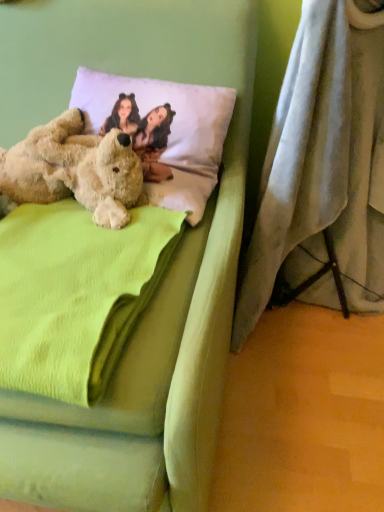
Describe the element at coordinates (171, 130) in the screenshot. I see `white soft pillow at upper center` at that location.

I want to click on gray fabric curtain at lower right, so click(323, 164).

Does point (61, 201) come in front of point (121, 81)?

Yes, it is in front of point (121, 81).

Is green fleece blanket at center situated inside white soft pillow at upper center or outside?

green fleece blanket at center is located beyond the bounds of white soft pillow at upper center.

Is green fleece blanket at center touching white soft pillow at upper center?

green fleece blanket at center and white soft pillow at upper center are not in contact.

Between fuzzy beige teddy bear at left and green fleece blanket at center, which one has larger width?

green fleece blanket at center.

Would you consider fuzzy beige teddy bear at left to be distant from green fleece blanket at center?

fuzzy beige teddy bear at left is actually quite close to green fleece blanket at center.

Considering their positions, is fuzzy beige teddy bear at left located in front of or behind green fleece blanket at center?

Visually, fuzzy beige teddy bear at left is located behind green fleece blanket at center.

Between fuzzy beige teddy bear at left and green fleece blanket at center, which one has more height?

Standing taller between the two is fuzzy beige teddy bear at left.

From a real-world perspective, between soft green fabric bed at center and fuzzy beige teddy bear at left, who is vertically higher?

In real-world perspective, fuzzy beige teddy bear at left is above.

How distant is soft green fabric bed at center from fuzzy beige teddy bear at left?

9.01 inches.

Considering the sizes of objects soft green fabric bed at center and fuzzy beige teddy bear at left in the image provided, who is shorter, soft green fabric bed at center or fuzzy beige teddy bear at left?

fuzzy beige teddy bear at left.

How many degrees apart are the facing directions of soft green fabric bed at center and fuzzy beige teddy bear at left?

The angle between the facing direction of soft green fabric bed at center and the facing direction of fuzzy beige teddy bear at left is 5.11 degrees.

Is gray fabric curtain at lower right located within soft green fabric bed at center?

No.

Between soft green fabric bed at center and gray fabric curtain at lower right, which one has larger width?

soft green fabric bed at center is wider.

Which is behind, soft green fabric bed at center or gray fabric curtain at lower right?

gray fabric curtain at lower right is further from the camera.

Is soft green fabric bed at center positioned in front of green fleece blanket at center?

Yes, the depth of soft green fabric bed at center is less than that of green fleece blanket at center.

Does soft green fabric bed at center have a greater width compared to green fleece blanket at center?

Indeed, soft green fabric bed at center has a greater width compared to green fleece blanket at center.

Consider the image. Can you tell me how much soft green fabric bed at center and green fleece blanket at center differ in facing direction?

→ 5.11 degrees separate the facing orientations of soft green fabric bed at center and green fleece blanket at center.

Is soft green fabric bed at center next to green fleece blanket at center?

No, soft green fabric bed at center is not touching green fleece blanket at center.

Does point (304, 274) come in front of point (182, 404)?

No, it is behind (182, 404).

Which of these two, gray fabric curtain at lower right or soft green fabric bed at center, is thinner?

Thinner between the two is gray fabric curtain at lower right.

Which of these two, gray fabric curtain at lower right or soft green fabric bed at center, stands taller?

soft green fabric bed at center.

From a real-world perspective, is gray fabric curtain at lower right above or below soft green fabric bed at center?

gray fabric curtain at lower right is below soft green fabric bed at center.

Is point (278, 224) positioned behind point (193, 112)?

That is True.

Between gray fabric curtain at lower right and white soft pillow at upper center, which one has smaller size?

Smaller between the two is white soft pillow at upper center.

From a real-world perspective, between gray fabric curtain at lower right and white soft pillow at upper center, who is vertically lower?

gray fabric curtain at lower right.

From their relative heights in the image, would you say gray fabric curtain at lower right is taller or shorter than white soft pillow at upper center?

Clearly, gray fabric curtain at lower right is taller compared to white soft pillow at upper center.

Identify the location of blanket on the left of white soft pillow at upper center. (75, 294).

At what (x,y) coordinates should I click in order to perform the action: click on teddy bear located above the green fleece blanket at center (from the image's perspective). Please return your answer as a coordinate pair (x, y). Looking at the image, I should click on (75, 169).

Estimate the real-world distances between objects in this image. Which object is further from gray fabric curtain at lower right, fuzzy beige teddy bear at left or white soft pillow at upper center?

fuzzy beige teddy bear at left is further to gray fabric curtain at lower right.

Based on their spatial positions, is soft green fabric bed at center or fuzzy beige teddy bear at left further from white soft pillow at upper center?

Based on the image, soft green fabric bed at center appears to be further to white soft pillow at upper center.

Considering their positions, is fuzzy beige teddy bear at left positioned further to soft green fabric bed at center than green fleece blanket at center?

fuzzy beige teddy bear at left.

Estimate the real-world distances between objects in this image. Which object is further from white soft pillow at upper center, gray fabric curtain at lower right or soft green fabric bed at center?

gray fabric curtain at lower right.

When comparing their distances from green fleece blanket at center, does gray fabric curtain at lower right or fuzzy beige teddy bear at left seem closer?

Based on the image, fuzzy beige teddy bear at left appears to be nearer to green fleece blanket at center.

When comparing their distances from fuzzy beige teddy bear at left, does gray fabric curtain at lower right or white soft pillow at upper center seem closer?

The object closer to fuzzy beige teddy bear at left is white soft pillow at upper center.

Which object lies nearer to the anchor point gray fabric curtain at lower right, green fleece blanket at center or fuzzy beige teddy bear at left?

Based on the image, fuzzy beige teddy bear at left appears to be nearer to gray fabric curtain at lower right.

When comparing their distances from gray fabric curtain at lower right, does soft green fabric bed at center or white soft pillow at upper center seem further?

Based on the image, soft green fabric bed at center appears to be further to gray fabric curtain at lower right.

At what (x,y) coordinates should I click in order to perform the action: click on teddy bear between white soft pillow at upper center and green fleece blanket at center in the vertical direction. Please return your answer as a coordinate pair (x, y). This screenshot has height=512, width=384. Looking at the image, I should click on (75, 169).

This screenshot has width=384, height=512. What are the coordinates of `pillow between green fleece blanket at center and gray fabric curtain at lower right from left to right` in the screenshot? It's located at (171, 130).

At what (x,y) coordinates should I click in order to perform the action: click on blanket between soft green fabric bed at center and white soft pillow at upper center from front to back. Please return your answer as a coordinate pair (x, y). This screenshot has width=384, height=512. Looking at the image, I should click on (75, 294).

Where is `blanket situated between soft green fabric bed at center and gray fabric curtain at lower right from left to right`? Image resolution: width=384 pixels, height=512 pixels. blanket situated between soft green fabric bed at center and gray fabric curtain at lower right from left to right is located at coordinates pos(75,294).